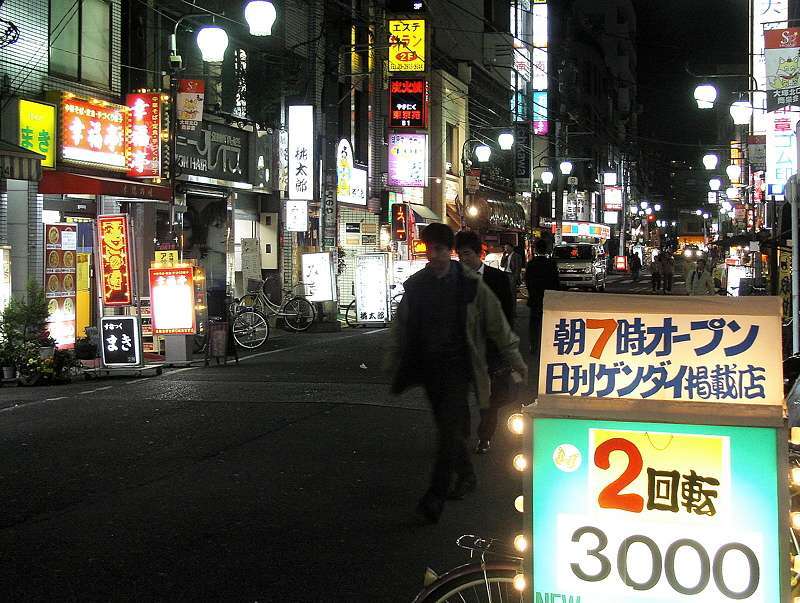
I want to click on light, so click(x=486, y=154).